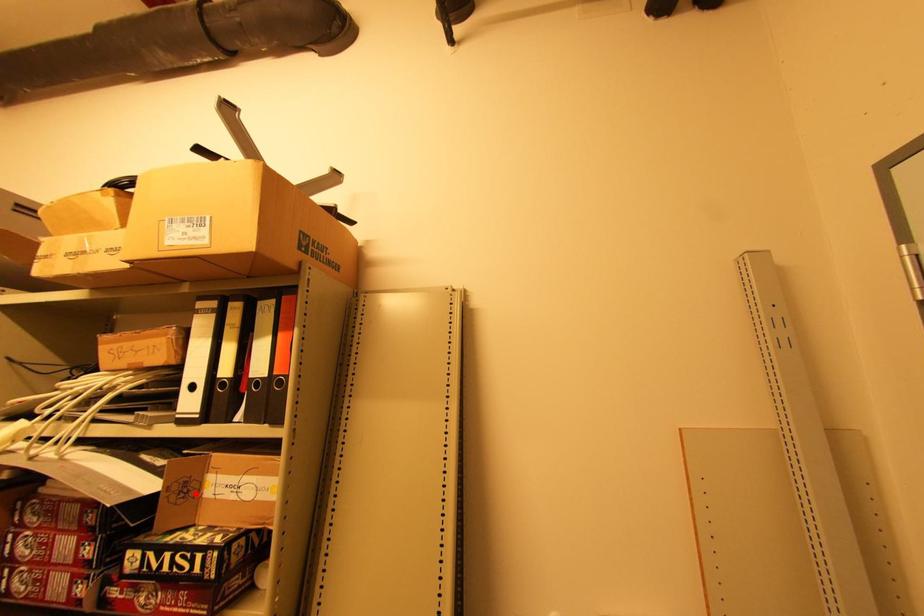
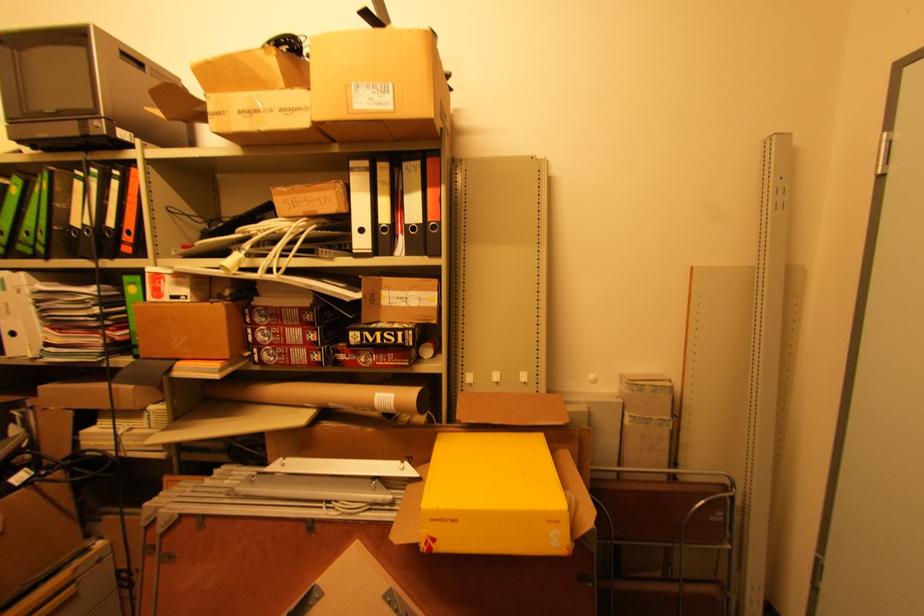
In the second image, find the point that corresponds to the highlighted location in the first image.

(380, 302)